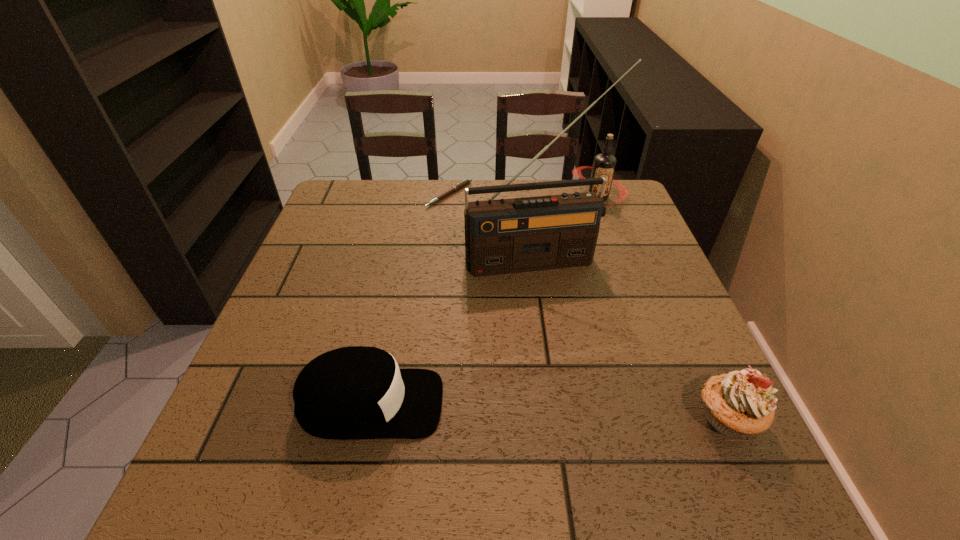
Where is `free space on the desktop that is between the fourth tallest object and the cupcake and is positioned on the front-facing side of the third farthest object`? The image size is (960, 540). free space on the desktop that is between the fourth tallest object and the cupcake and is positioned on the front-facing side of the third farthest object is located at coordinates (593, 413).

At what (x,y) coordinates should I click in order to perform the action: click on free spot on the desktop that is between the cap and the cupcake and is positioned at the nib of the shortest object. Please return your answer as a coordinate pair (x, y). The image size is (960, 540). Looking at the image, I should click on (554, 411).

Find the location of a particular element. free spot on the desktop that is between the cap and the cupcake and is positioned on the label of the fourth shortest object is located at coordinates (536, 410).